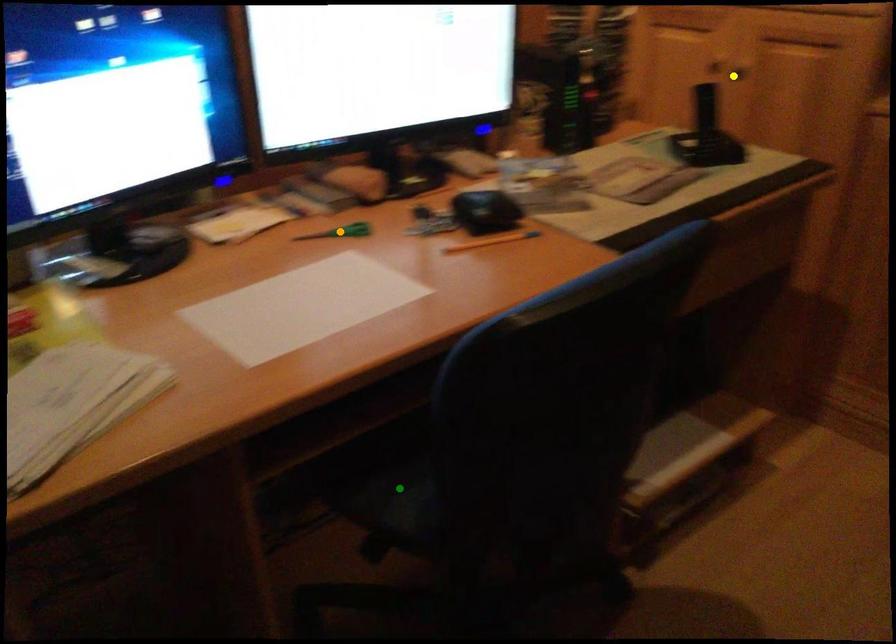
Order these from farthest to nearest:
orange point
green point
yellow point

yellow point < orange point < green point